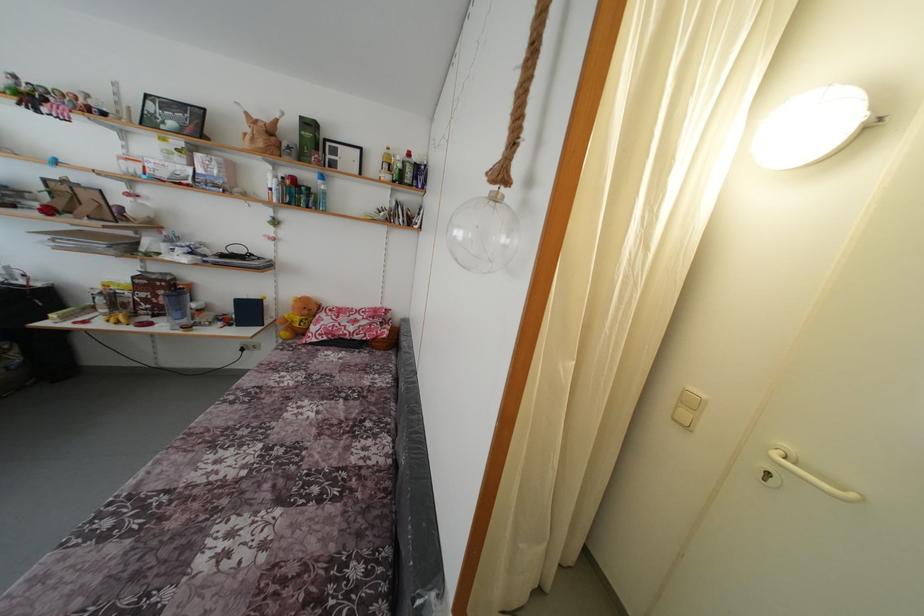
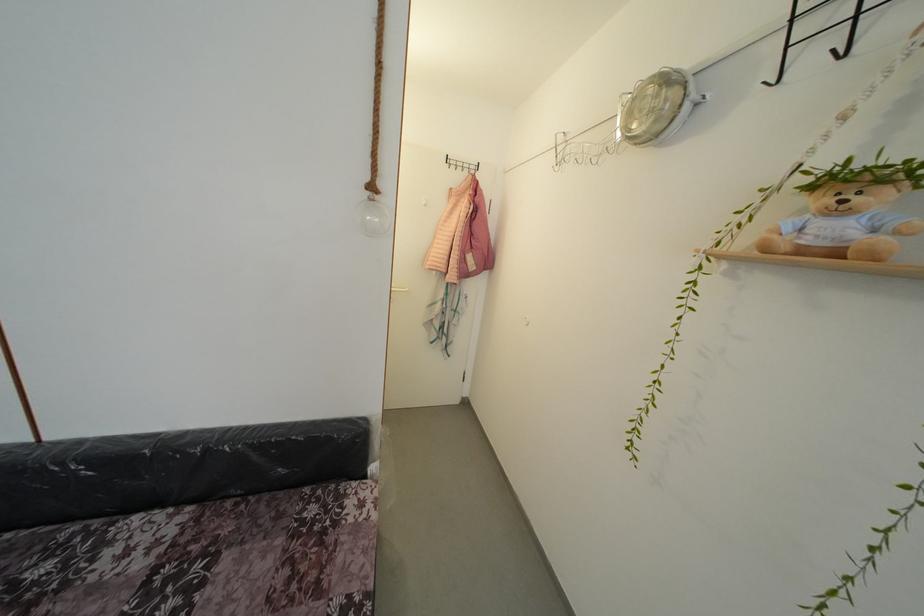
Locate, in the second image, the point that corresponds to (x=359, y=450) in the first image.

(99, 585)